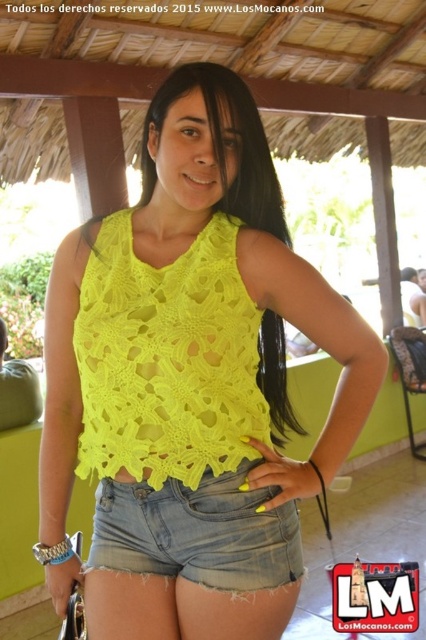
Which is below, neon yellow crochet tank top at center or denim shorts at lower center?

Positioned lower is denim shorts at lower center.

Does neon yellow crochet tank top at center come in front of denim shorts at lower center?

That is True.

Who is more distant from viewer, (230, 372) or (276, 548)?

The point (230, 372) is behind.

This screenshot has height=640, width=426. Find the location of `neon yellow crochet tank top at center`. neon yellow crochet tank top at center is located at coordinates 166,358.